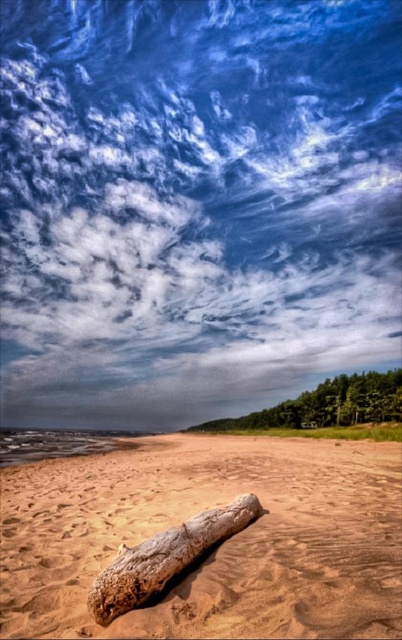
Question: Among these objects, which one is farthest from the camera?

Choices:
 (A) brown textured log at center
 (B) brown sandy beach at lower center

Answer: (A)

Question: Is white fluffy cloud at upper center below brown sandy beach at lower center?

Choices:
 (A) yes
 (B) no

Answer: (B)

Question: Can you confirm if white fluffy cloud at upper center is positioned to the left of brown sandy beach at lower center?

Choices:
 (A) no
 (B) yes

Answer: (B)

Question: Which is nearer to the white fluffy cloud at upper center?

Choices:
 (A) brown sandy beach at lower center
 (B) brown textured log at center

Answer: (A)

Question: Is white fluffy cloud at upper center to the right of brown textured log at center from the viewer's perspective?

Choices:
 (A) no
 (B) yes

Answer: (A)

Question: Which point is farther to the camera?

Choices:
 (A) (373, 467)
 (B) (145, 570)

Answer: (A)